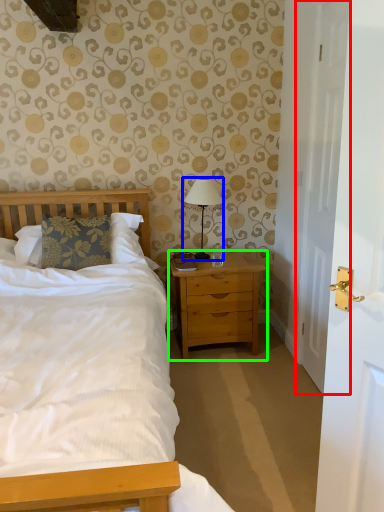
Question: Considering the real-world distances, which object is closest to door (highlighted by a red box)? bedside lamp (highlighted by a blue box) or nightstand (highlighted by a green box).

Choices:
 (A) bedside lamp
 (B) nightstand

Answer: (B)